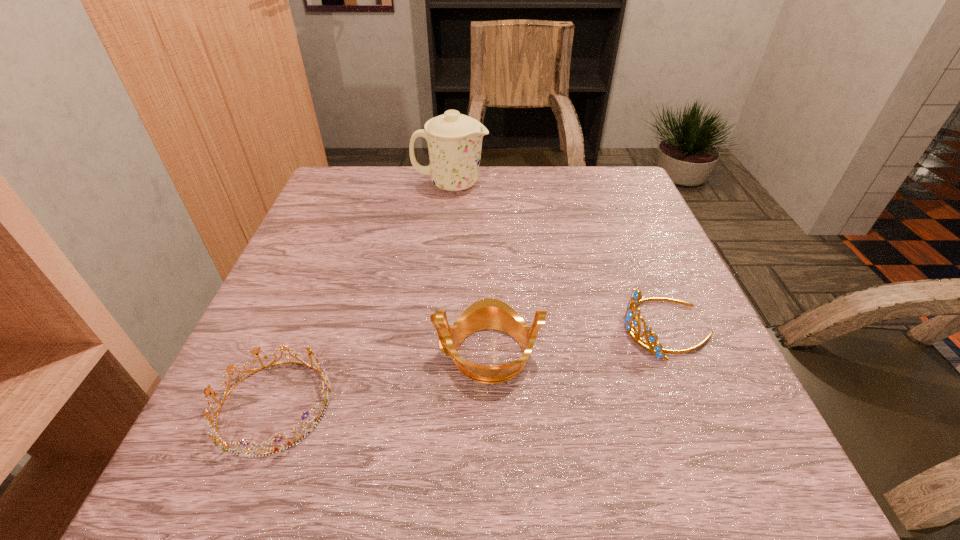
Identify the location of blank space located 0.100m on the front-facing side of the rightmost tiara. Image resolution: width=960 pixels, height=540 pixels. (569, 328).

Locate an element on the screen. Image resolution: width=960 pixels, height=540 pixels. vacant area situated 0.310m on the front-facing side of the rightmost tiara is located at coordinates (457, 328).

I want to click on vacant point located on the front-facing side of the rightmost tiara, so click(457, 328).

This screenshot has width=960, height=540. I want to click on free space located 0.320m on the front-facing side of the shortest object, so click(x=534, y=405).

At what (x,y) coordinates should I click in order to perform the action: click on object that is at the far edge. Please return your answer as a coordinate pair (x, y). Looking at the image, I should click on (454, 140).

Identify the location of object present at the near edge. The image size is (960, 540). (218, 441).

Where is `object that is at the left edge`? The image size is (960, 540). object that is at the left edge is located at coordinates (218, 441).

This screenshot has width=960, height=540. I want to click on object positioned at the right edge, so click(631, 322).

This screenshot has height=540, width=960. In order to click on object present at the near left corner in this screenshot , I will do `click(218, 441)`.

Identify the location of vacant space at the far edge of the desktop. This screenshot has height=540, width=960. (492, 180).